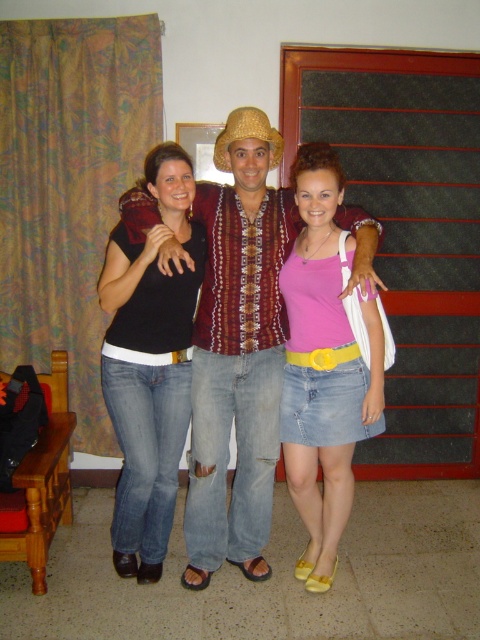
Question: Estimate the real-world distances between objects in this image. Which object is farther from the golden straw cowboy hat at center?

Choices:
 (A) patterned fabric shirt at center
 (B) black matte t-shirt at center

Answer: (B)

Question: Does black matte t-shirt at center come in front of golden straw cowboy hat at center?

Choices:
 (A) yes
 (B) no

Answer: (A)

Question: Can you confirm if patterned fabric shirt at center is thinner than black matte t-shirt at center?

Choices:
 (A) no
 (B) yes

Answer: (A)

Question: Can you confirm if black matte t-shirt at center is positioned below golden straw cowboy hat at center?

Choices:
 (A) no
 (B) yes

Answer: (B)

Question: Considering the real-world distances, which object is closest to the golden straw cowboy hat at center?

Choices:
 (A) pink denim skirt at center
 (B) patterned fabric shirt at center

Answer: (B)

Question: Among these objects, which one is farthest from the camera?

Choices:
 (A) patterned fabric shirt at center
 (B) golden straw cowboy hat at center
 (C) black matte t-shirt at center
 (D) pink denim skirt at center

Answer: (B)